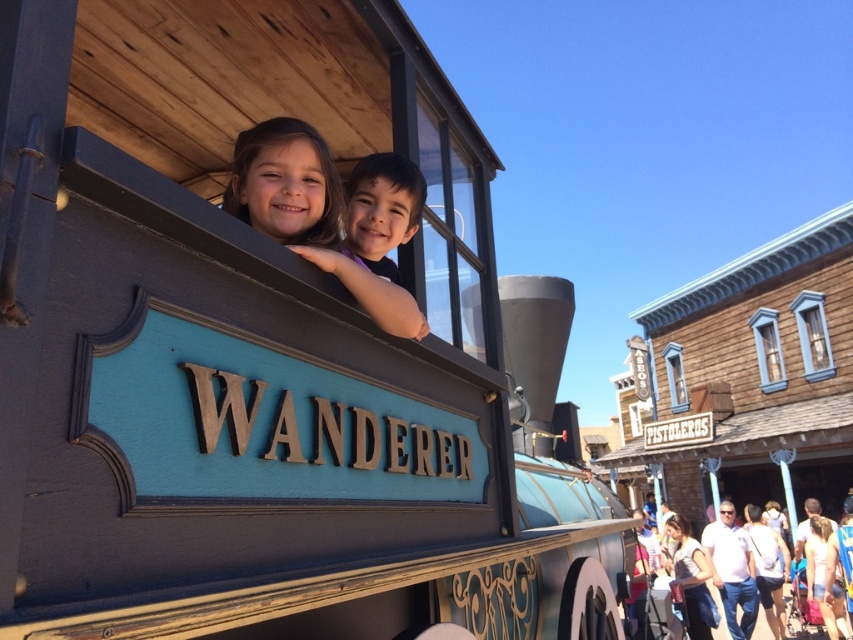
What is the color of the hair of the child at the point with coordinates (x=309, y=214)?

The point at coordinates (x=309, y=214) indicates matte black hair at upper center, so the hair color is matte black.

You are standing in front of the vintage train car named WANDERER. You notice two points marked on the train car. The first point is at coordinate point (x=334, y=244) and the second is at point (x=741, y=550). If you want to touch both points starting from the nearest one, which point should you reach first?

You should reach point (x=334, y=244) first because it is closer to you than point (x=741, y=550).